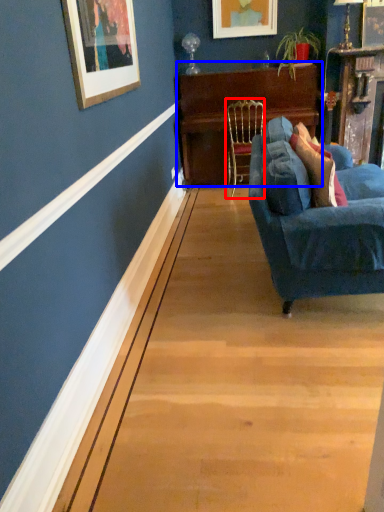
Question: Which object is closer to the camera taking this photo, chair (highlighted by a red box) or table (highlighted by a blue box)?

Choices:
 (A) chair
 (B) table

Answer: (A)